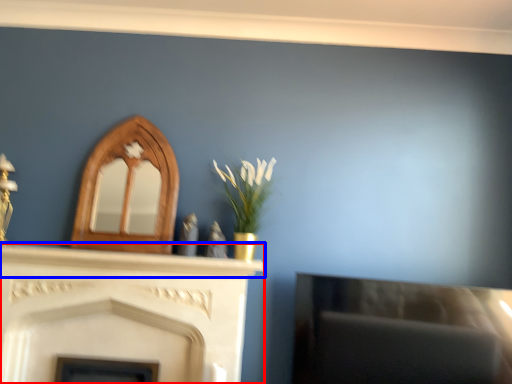
Question: Which object is further to the camera taking this photo, fireplace (highlighted by a red box) or mantle (highlighted by a blue box)?

Choices:
 (A) fireplace
 (B) mantle

Answer: (B)